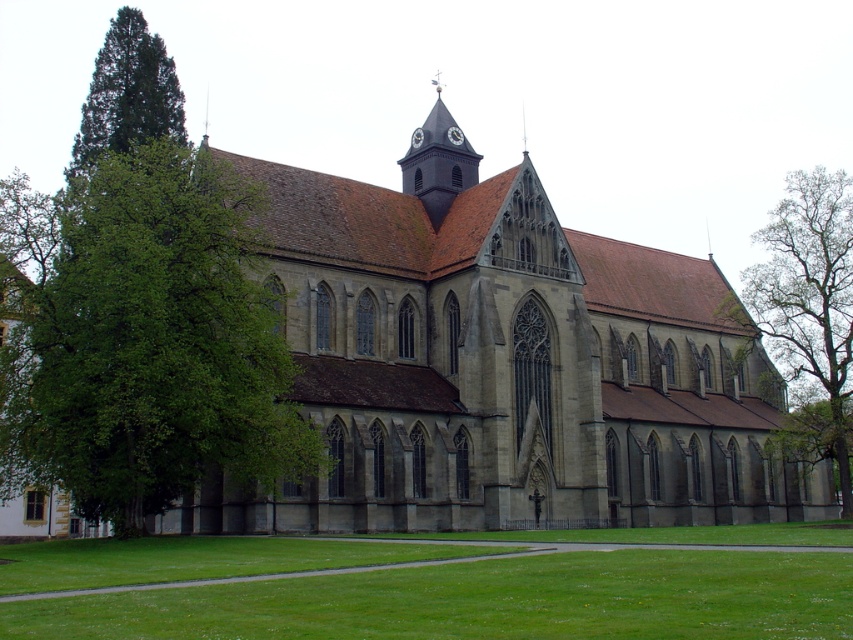
Is gray stone church at center to the left of green leafy tree at right from the viewer's perspective?

Indeed, gray stone church at center is positioned on the left side of green leafy tree at right.

This screenshot has height=640, width=853. Describe the element at coordinates (503, 372) in the screenshot. I see `gray stone church at center` at that location.

Does point (345, 307) come farther from viewer compared to point (793, 324)?

No, (345, 307) is in front of (793, 324).

The height and width of the screenshot is (640, 853). Identify the location of gray stone church at center. (503, 372).

Does green leafy tree at left have a smaller size compared to green coniferous tree at left?

Yes, green leafy tree at left is smaller than green coniferous tree at left.

Does green leafy tree at left appear on the right side of green coniferous tree at left?

Correct, you'll find green leafy tree at left to the right of green coniferous tree at left.

In order to click on green leafy tree at left in this screenshot , I will do `click(149, 344)`.

This screenshot has height=640, width=853. Describe the element at coordinates (809, 314) in the screenshot. I see `green leafy tree at right` at that location.

The height and width of the screenshot is (640, 853). What do you see at coordinates (809, 314) in the screenshot?
I see `green leafy tree at right` at bounding box center [809, 314].

Image resolution: width=853 pixels, height=640 pixels. In order to click on green leafy tree at right in this screenshot , I will do `click(809, 314)`.